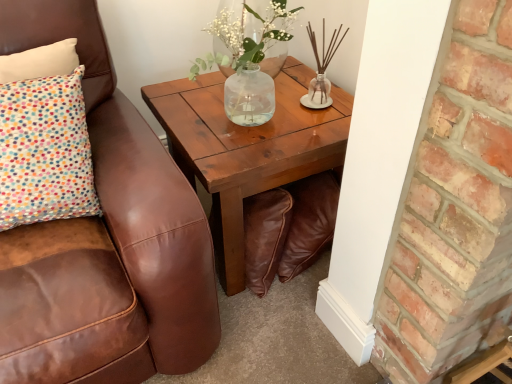
Question: From their relative heights in the image, would you say wooden coffee table at center is taller or shorter than translucent glass vase at upper center?

Choices:
 (A) short
 (B) tall

Answer: (B)

Question: From a real-world perspective, is wooden coffee table at center positioned above or below translucent glass vase at upper center?

Choices:
 (A) below
 (B) above

Answer: (A)

Question: Relative to translucent glass vase at upper center, is wooden coffee table at center in front or behind?

Choices:
 (A) front
 (B) behind

Answer: (A)

Question: Considering the relative positions of translucent glass vase at upper center and wooden coffee table at center in the image provided, is translucent glass vase at upper center to the left or to the right of wooden coffee table at center?

Choices:
 (A) left
 (B) right

Answer: (A)

Question: Is translucent glass vase at upper center taller or shorter than wooden coffee table at center?

Choices:
 (A) tall
 (B) short

Answer: (B)

Question: Considering the positions of point (278, 26) and point (300, 160), is point (278, 26) closer or farther from the camera than point (300, 160)?

Choices:
 (A) closer
 (B) farther

Answer: (B)

Question: From a real-world perspective, is translucent glass vase at upper center above or below wooden coffee table at center?

Choices:
 (A) above
 (B) below

Answer: (A)